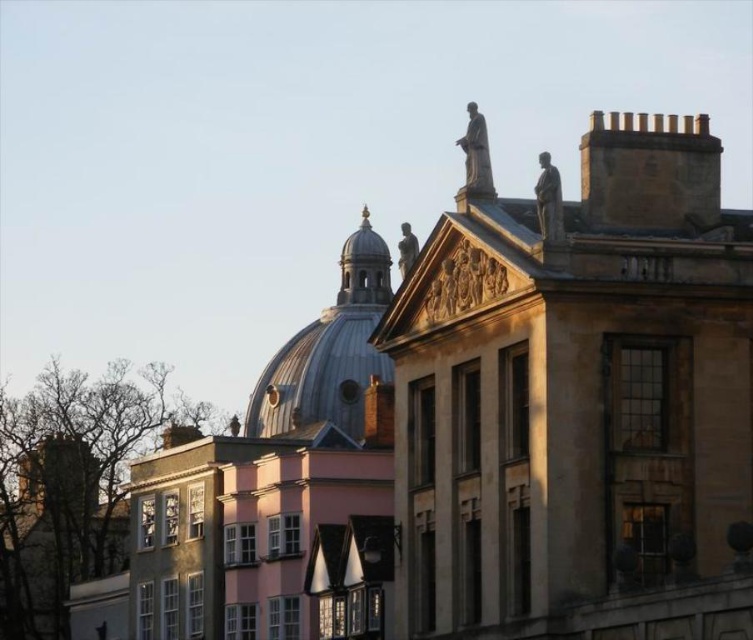
Is beige stone building at upper right bigger than smooth white dome at center?

Yes, beige stone building at upper right is bigger than smooth white dome at center.

Which is in front, point (529, 362) or point (293, 401)?

Point (529, 362)

Locate an element on the screen. Image resolution: width=753 pixels, height=640 pixels. beige stone building at upper right is located at coordinates (578, 397).